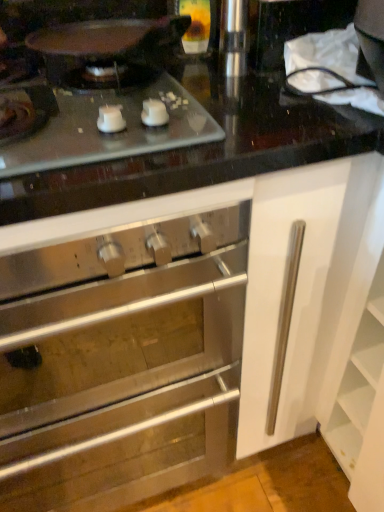
Question: From a real-world perspective, is stainless steel oven at center positioned above or below matte glass cooktop at upper left?

Choices:
 (A) above
 (B) below

Answer: (B)

Question: Is stainless steel oven at center wider or thinner than matte glass cooktop at upper left?

Choices:
 (A) wide
 (B) thin

Answer: (A)

Question: From the image's perspective, relative to matte glass cooktop at upper left, is stainless steel oven at center above or below?

Choices:
 (A) above
 (B) below

Answer: (B)

Question: Considering the positions of matte glass cooktop at upper left and stainless steel oven at center in the image, is matte glass cooktop at upper left wider or thinner than stainless steel oven at center?

Choices:
 (A) wide
 (B) thin

Answer: (B)

Question: Does point (182, 136) appear closer or farther from the camera than point (200, 271)?

Choices:
 (A) closer
 (B) farther

Answer: (A)

Question: From the image's perspective, relative to stainless steel oven at center, is matte glass cooktop at upper left above or below?

Choices:
 (A) below
 (B) above

Answer: (B)

Question: Visually, is matte glass cooktop at upper left positioned to the left or to the right of stainless steel oven at center?

Choices:
 (A) left
 (B) right

Answer: (B)